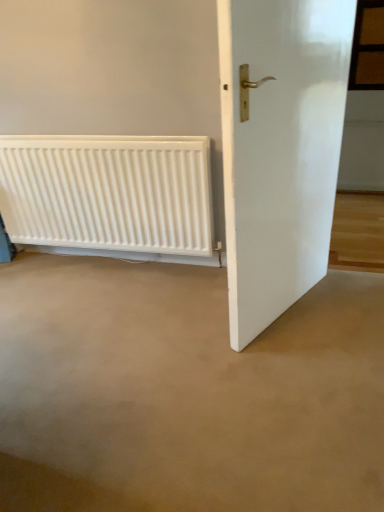
Question: From the image's perspective, is brown wooden window at upper right on top of white glossy door at right?

Choices:
 (A) yes
 (B) no

Answer: (A)

Question: Does brown wooden window at upper right have a greater height compared to white glossy door at right?

Choices:
 (A) yes
 (B) no

Answer: (B)

Question: Considering the relative sizes of brown wooden window at upper right and white glossy door at right in the image provided, is brown wooden window at upper right thinner than white glossy door at right?

Choices:
 (A) no
 (B) yes

Answer: (B)

Question: Is brown wooden window at upper right looking in the opposite direction of white glossy door at right?

Choices:
 (A) yes
 (B) no

Answer: (B)

Question: Is brown wooden window at upper right to the right of white glossy door at right from the viewer's perspective?

Choices:
 (A) yes
 (B) no

Answer: (A)

Question: Considering the relative positions of brown wooden window at upper right and white glossy door at right in the image provided, is brown wooden window at upper right to the left of white glossy door at right from the viewer's perspective?

Choices:
 (A) no
 (B) yes

Answer: (A)

Question: From the image's perspective, does white glossy door at right appear lower than brown wooden window at upper right?

Choices:
 (A) yes
 (B) no

Answer: (A)

Question: Is white glossy door at right further to camera compared to brown wooden window at upper right?

Choices:
 (A) no
 (B) yes

Answer: (A)

Question: Is white glossy door at right positioned before brown wooden window at upper right?

Choices:
 (A) yes
 (B) no

Answer: (A)

Question: Does white glossy door at right have a lesser width compared to brown wooden window at upper right?

Choices:
 (A) yes
 (B) no

Answer: (B)

Question: Is white glossy door at right shorter than brown wooden window at upper right?

Choices:
 (A) no
 (B) yes

Answer: (A)

Question: Is white glossy door at right outside of brown wooden window at upper right?

Choices:
 (A) yes
 (B) no

Answer: (A)

Question: Considering the relative sizes of white matte radiator at lower left and white glossy door at right in the image provided, is white matte radiator at lower left smaller than white glossy door at right?

Choices:
 (A) yes
 (B) no

Answer: (A)